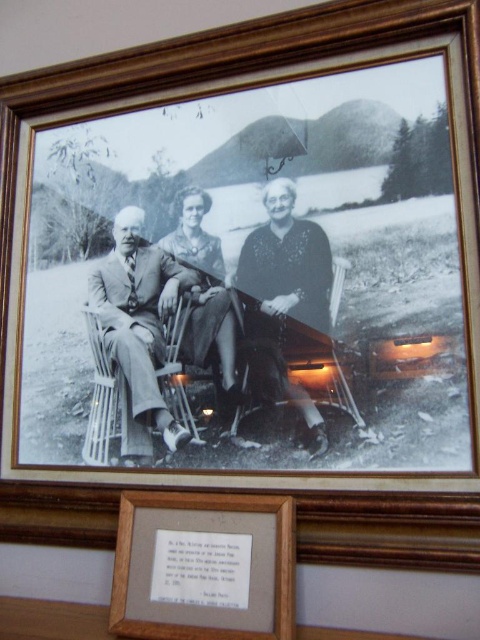
Question: Among these objects, which one is nearest to the camera?

Choices:
 (A) smooth fabric suit at center
 (B) matte black dress at center
 (C) wooden chair at lower center

Answer: (C)

Question: Is matte suit at left thinner than wooden chair at lower center?

Choices:
 (A) no
 (B) yes

Answer: (A)

Question: Does matte suit at left have a larger size compared to matte black dress at center?

Choices:
 (A) no
 (B) yes

Answer: (B)

Question: Is matte black dress at center thinner than wooden chair at lower center?

Choices:
 (A) no
 (B) yes

Answer: (B)

Question: Estimate the real-world distances between objects in this image. Which object is farther from the wooden chair at lower center?

Choices:
 (A) smooth fabric suit at center
 (B) matte suit at left
 (C) matte black dress at center

Answer: (B)

Question: Among these objects, which one is farthest from the camera?

Choices:
 (A) matte black dress at center
 (B) wooden chair at lower center

Answer: (A)